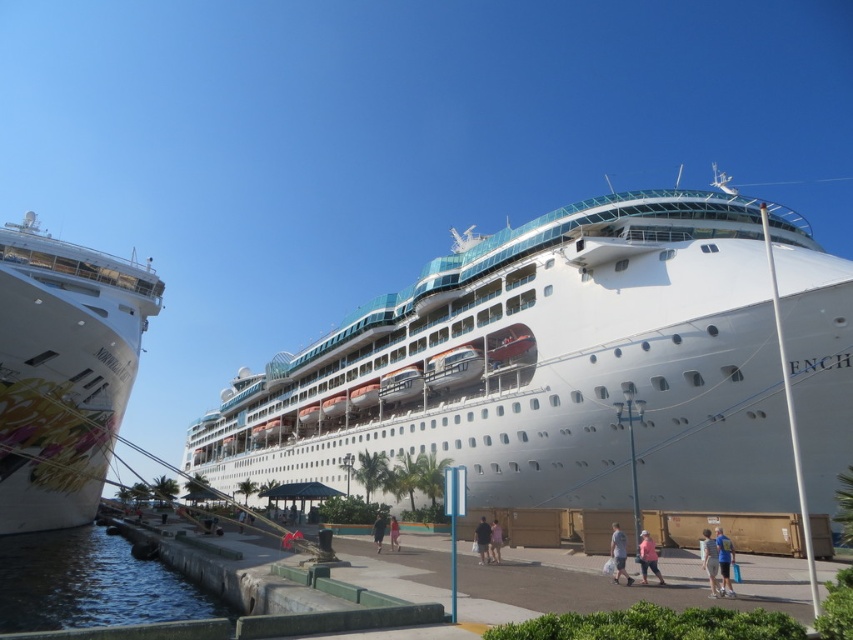
Question: Considering the relative positions of pink fabric shirt at center and blue fabric shirt at center in the image provided, where is pink fabric shirt at center located with respect to blue fabric shirt at center?

Choices:
 (A) above
 (B) below

Answer: (A)

Question: Where is clear water at dock left located in relation to blue fabric shirt at lower right in the image?

Choices:
 (A) above
 (B) below

Answer: (B)

Question: Which object is closer to the camera taking this photo?

Choices:
 (A) blue fabric shirt at center
 (B) clear water at dock left
 (C) light blue jeans at center

Answer: (B)

Question: Considering the relative positions of white glossy cruise ship at left and pink fabric at center in the image provided, where is white glossy cruise ship at left located with respect to pink fabric at center?

Choices:
 (A) above
 (B) below

Answer: (A)

Question: Based on their relative distances, which object is farther from the white glossy cruise ship at center?

Choices:
 (A) light blue denim shorts at lower right
 (B) pink fabric at center
 (C) pink fabric dress at center
 (D) pink fabric shirt at center

Answer: (D)

Question: Which of the following is the farthest from the observer?

Choices:
 (A) (479, 550)
 (B) (645, 564)
 (C) (520, 310)
 (D) (618, 572)

Answer: (C)